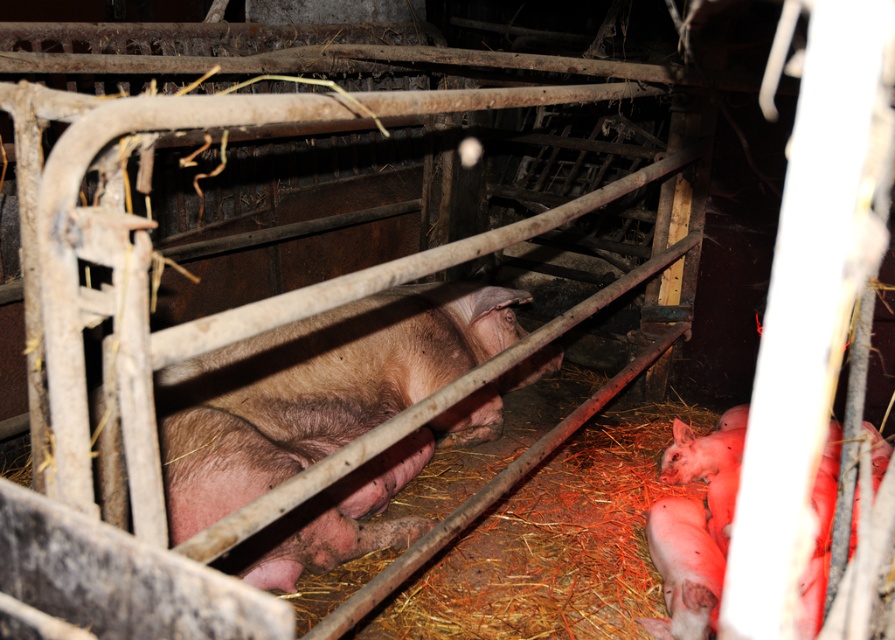
Does pinkish-brown skin at center lie behind pink soft piglet at lower right?

No, it is not.

Does pinkish-brown skin at center have a larger size compared to pink soft piglet at lower right?

Yes.

This screenshot has width=895, height=640. I want to click on pinkish-brown skin at center, so click(313, 388).

Which is more to the right, pinkish-brown skin at center or pink soft fur pig at lower right?

pink soft fur pig at lower right

What do you see at coordinates (313, 388) in the screenshot? I see `pinkish-brown skin at center` at bounding box center [313, 388].

Based on the photo, who is more distant from viewer, [278,428] or [663,582]?

The point [278,428] is more distant.

I want to click on pinkish-brown skin at center, so click(x=313, y=388).

From the picture: Is pink soft piglet at lower right to the right of pink soft fur pig at lower right from the viewer's perspective?

Correct, you'll find pink soft piglet at lower right to the right of pink soft fur pig at lower right.

Who is positioned more to the right, pink soft piglet at lower right or pink soft fur pig at lower right?

From the viewer's perspective, pink soft piglet at lower right appears more on the right side.

Does point (699, 472) lie behind point (712, 605)?

Yes, point (699, 472) is behind point (712, 605).

Identify the location of pink soft piglet at lower right. (709, 467).